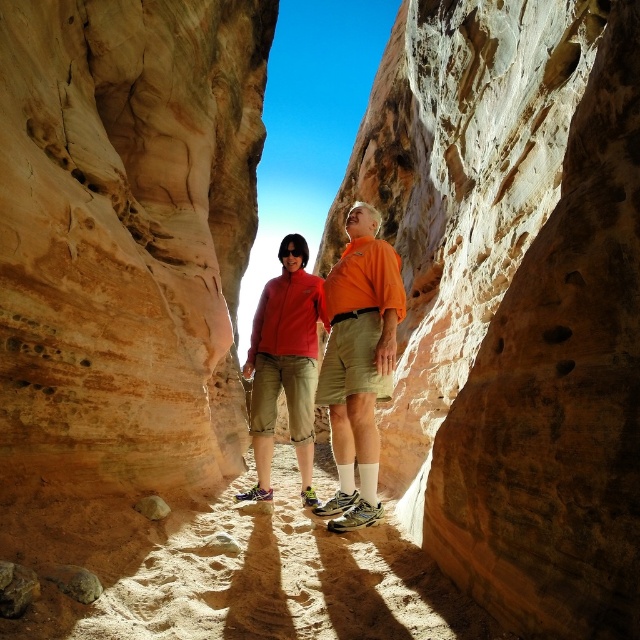
Question: Estimate the real-world distances between objects in this image. Which object is farther from the matte orange shirt at center?

Choices:
 (A) smooth brown rock at lower left
 (B) smooth brown rock at lower center

Answer: (A)

Question: Is khaki shorts at center wider than smooth brown rock at lower center?

Choices:
 (A) no
 (B) yes

Answer: (B)

Question: Which object appears farthest from the camera in this image?

Choices:
 (A) smooth brown rock at lower center
 (B) smooth brown rock at lower left

Answer: (A)

Question: Does khaki shorts at center appear on the left side of smooth brown rock at lower center?

Choices:
 (A) no
 (B) yes

Answer: (A)

Question: Which object is positioned closest to the smooth brown rock at lower left?

Choices:
 (A) smooth brown rock at lower center
 (B) khaki shorts at center

Answer: (A)

Question: Does matte orange shirt at center appear under smooth brown rock at lower center?

Choices:
 (A) yes
 (B) no

Answer: (B)